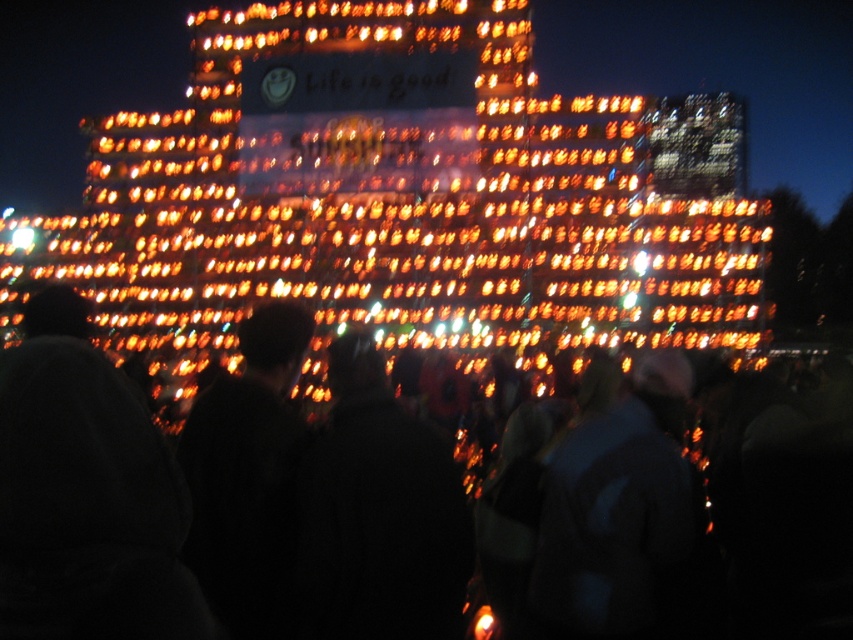
Question: Which object is positioned farthest from the black matte jacket at center?

Choices:
 (A) dark blue jacket at center
 (B) black fuzzy hat at lower left

Answer: (B)

Question: Where is black fuzzy hat at lower left located in relation to dark blue jacket at center in the image?

Choices:
 (A) left
 (B) right

Answer: (A)

Question: Can you confirm if black matte jacket at center is positioned below dark blue jacket at center?

Choices:
 (A) yes
 (B) no

Answer: (B)

Question: Observing the image, what is the correct spatial positioning of black fuzzy hat at lower left in reference to dark blue jacket at center?

Choices:
 (A) below
 (B) above

Answer: (B)

Question: Which of the following is the closest to the observer?

Choices:
 (A) (363, 348)
 (B) (86, 582)

Answer: (B)

Question: Based on their relative distances, which object is farther from the black fuzzy hat at lower left?

Choices:
 (A) black matte jacket at center
 (B) dark blue jacket at center

Answer: (B)